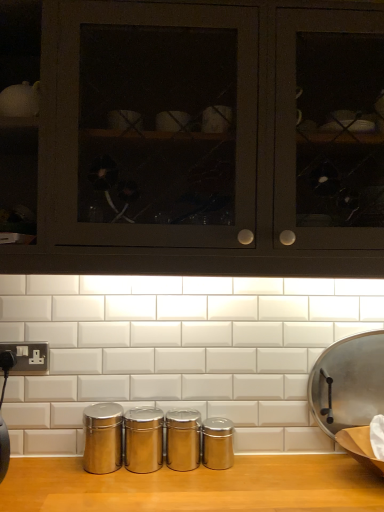
Question: Considering the relative positions of matte black cabinets at upper center and silver metallic plug socket at lower left in the image provided, is matte black cabinets at upper center to the left or to the right of silver metallic plug socket at lower left?

Choices:
 (A) right
 (B) left

Answer: (A)

Question: Is point (132, 245) positioned closer to the camera than point (39, 362)?

Choices:
 (A) closer
 (B) farther

Answer: (A)

Question: Which of these objects is positioned closest to the silver metallic plug socket at lower left?

Choices:
 (A) metallic silver frying pan at right
 (B) matte black cabinets at upper center

Answer: (B)

Question: Estimate the real-world distances between objects in this image. Which object is closer to the silver metallic plug socket at lower left?

Choices:
 (A) metallic silver frying pan at right
 (B) matte black cabinets at upper center

Answer: (B)